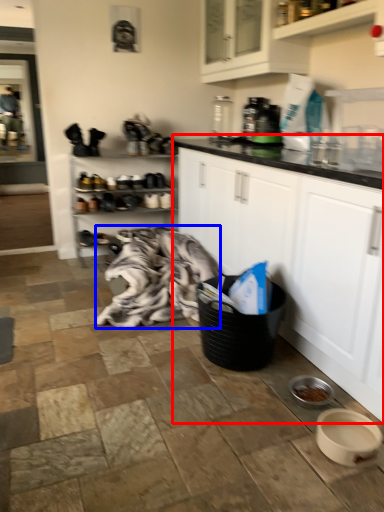
Question: Which of the following is the farthest to the observer, cabinetry (highlighted by a red box) or blanket (highlighted by a blue box)?

Choices:
 (A) cabinetry
 (B) blanket

Answer: (B)